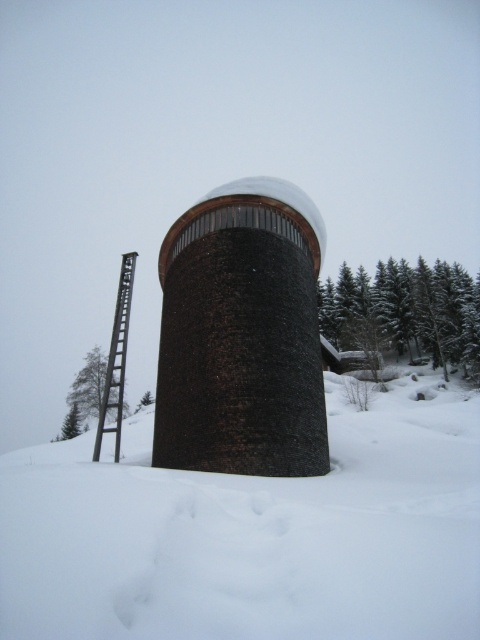
Who is lower down, white powdery snow at lower center or green matte tree at left?

green matte tree at left

Does white powdery snow at lower center appear on the left side of green matte tree at left?

Incorrect, white powdery snow at lower center is not on the left side of green matte tree at left.

This screenshot has width=480, height=640. Find the location of `white powdery snow at lower center`. white powdery snow at lower center is located at coordinates (253, 532).

Is green textured trees at right to the right of green matte tree at left from the viewer's perspective?

Yes, green textured trees at right is to the right of green matte tree at left.

Is green textured trees at right closer to camera compared to green matte tree at left?

That is True.

Is point (445, 300) closer to viewer compared to point (85, 420)?

That is True.

I want to click on green textured trees at right, so click(406, 310).

Is white powdery snow at lower center wider than brown textured tower at center?

Yes.

Which is more to the right, white powdery snow at lower center or brown textured tower at center?

From the viewer's perspective, white powdery snow at lower center appears more on the right side.

Locate an element on the screen. This screenshot has height=640, width=480. white powdery snow at lower center is located at coordinates (253, 532).